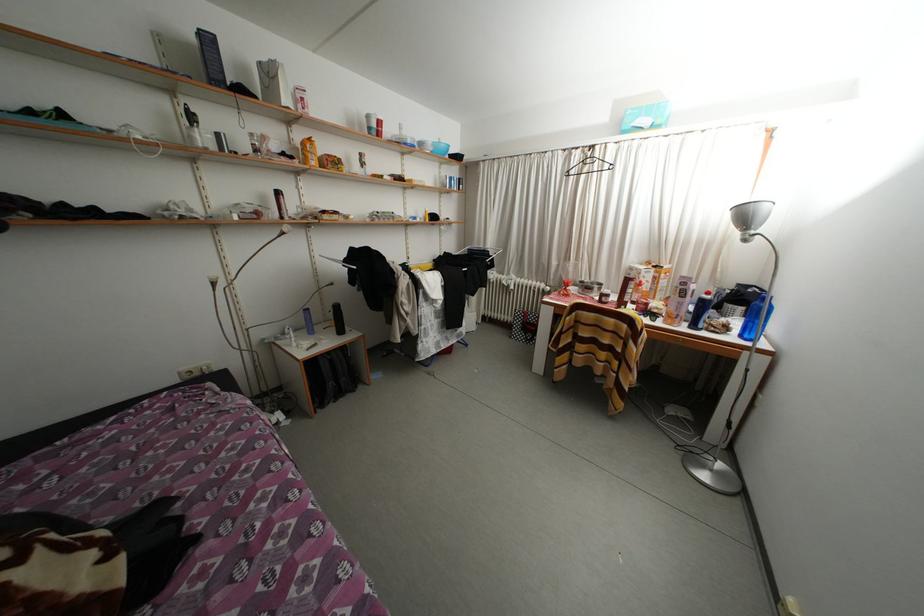
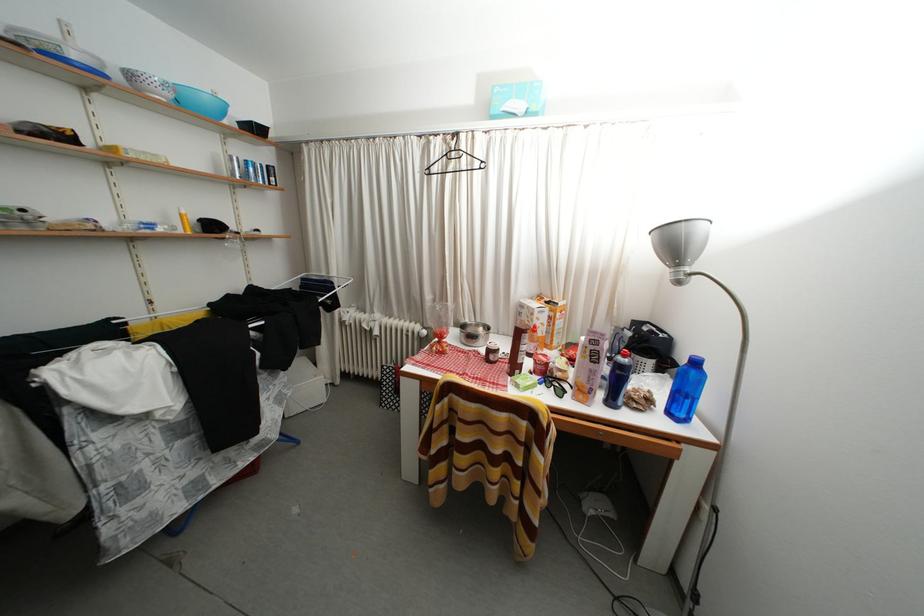
In the second image, find the point that corresponds to point 700,331 in the first image.

(618, 408)